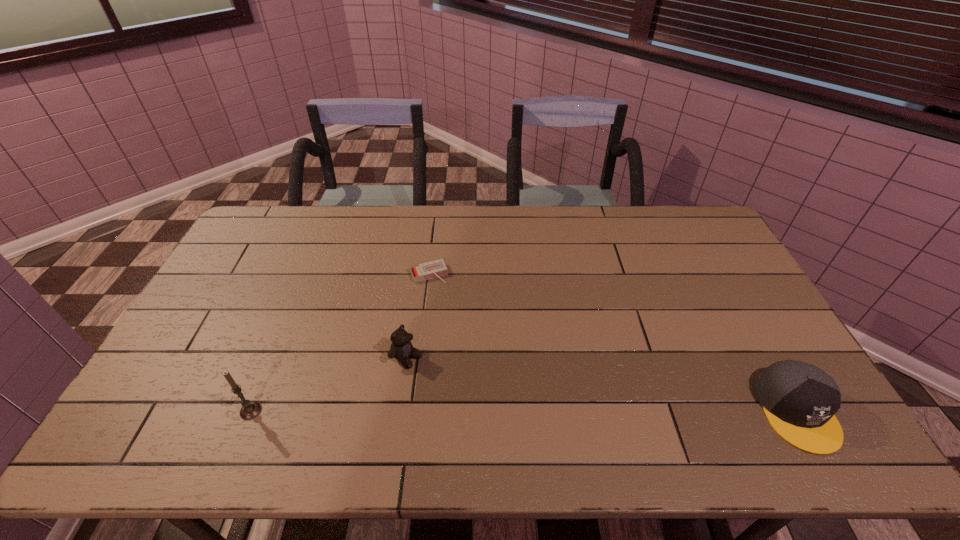
You are a GUI agent. You are given a task and a screenshot of the screen. Output one action in this format:
    pyautogui.click(x=<x>, y=<y>)
    Task: Click on the leftmost object
    This screenshot has width=960, height=540.
    Given the screenshot: What is the action you would take?
    pyautogui.click(x=250, y=410)

The image size is (960, 540). Find the location of `candle`. candle is located at coordinates (250, 410).

You are a GUI agent. You are given a task and a screenshot of the screen. Output one action in this format:
    pyautogui.click(x=<x>, y=<y>)
    Task: Click on the cap
    
    Given the screenshot: What is the action you would take?
    pyautogui.click(x=800, y=400)

Where is `teddy bear`? teddy bear is located at coordinates (401, 348).

The width and height of the screenshot is (960, 540). What are the coordinates of `matchbox` in the screenshot? It's located at (436, 268).

This screenshot has width=960, height=540. What are the coordinates of `the farthest object` in the screenshot? It's located at (436, 268).

The height and width of the screenshot is (540, 960). I want to click on free space located on the left of the candle, so click(x=197, y=411).

I want to click on free space located 0.180m on the face of the third nearest object, so click(473, 397).

Locate an element on the screen. The image size is (960, 540). free region located on the face of the third nearest object is located at coordinates (448, 382).

Where is `blank space located 0.080m on the face of the third nearest object`? blank space located 0.080m on the face of the third nearest object is located at coordinates (442, 379).